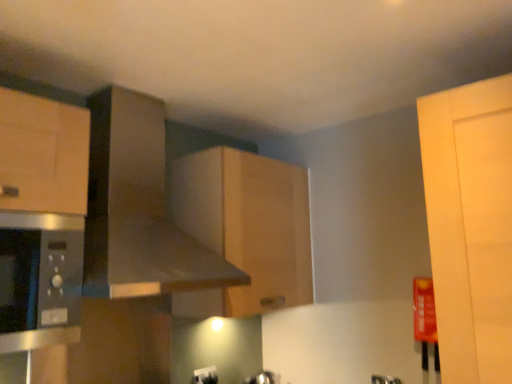
Question: Is point (125, 132) positioned closer to the camera than point (197, 369)?

Choices:
 (A) closer
 (B) farther

Answer: (A)

Question: From the image's perspective, is metallic gray exhaust hood at upper center above or below white plastic electric outlet at lower center?

Choices:
 (A) above
 (B) below

Answer: (A)

Question: Which object is the farthest from the satin silver microwave at left?

Choices:
 (A) matte silver faucet at lower center
 (B) metallic gray exhaust hood at upper center
 (C) wooden cabinet at center
 (D) white plastic electric outlet at lower center

Answer: (A)

Question: Which object is positioned farthest from the matte silver faucet at lower center?

Choices:
 (A) satin silver microwave at left
 (B) metallic gray exhaust hood at upper center
 (C) wooden cabinet at center
 (D) white plastic electric outlet at lower center

Answer: (A)